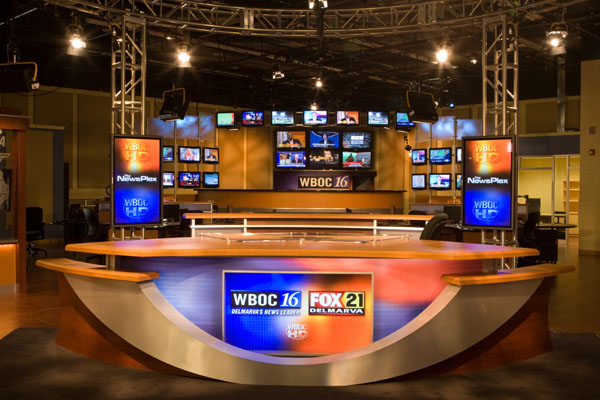
You are a GUI agent. You are given a task and a screenshot of the screen. Output one action in this format:
    pyautogui.click(x=<x>, y=<y>)
    Task: Click on the floor
    
    Given the screenshot: What is the action you would take?
    pyautogui.click(x=80, y=357), pyautogui.click(x=552, y=368)